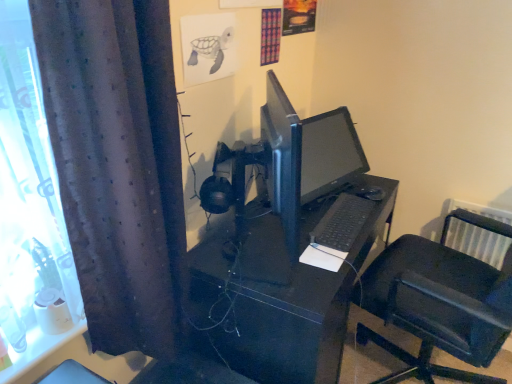
Where is `vacant point above black matte desk at center (from a real-world perspective)`? The image size is (512, 384). vacant point above black matte desk at center (from a real-world perspective) is located at coordinates (302, 223).